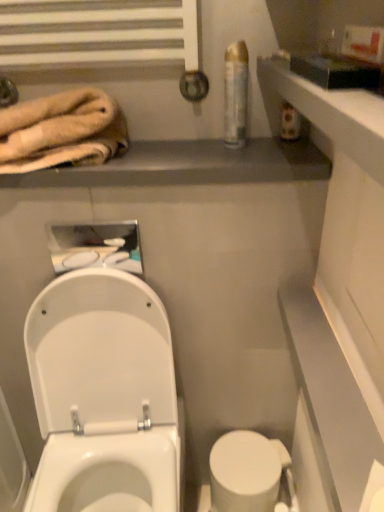
This screenshot has width=384, height=512. I want to click on vacant point to the left of clear plastic can at upper right, so click(x=174, y=152).